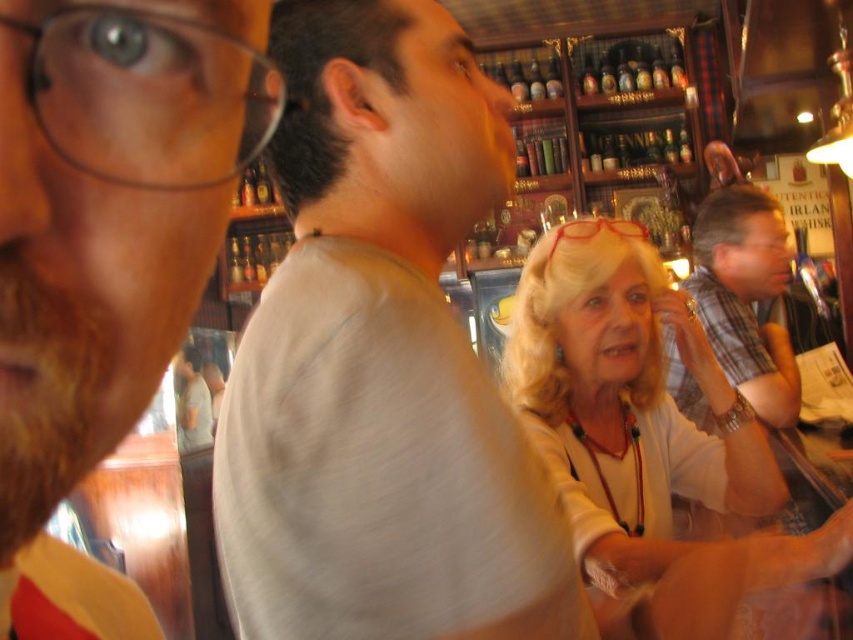
Question: Is gray cotton shirt at center to the right of light beige blouse at center from the viewer's perspective?

Choices:
 (A) yes
 (B) no

Answer: (B)

Question: Among these objects, which one is farthest from the camera?

Choices:
 (A) plaid shirt at right
 (B) gray cotton shirt at center

Answer: (A)

Question: Does white matte shirt at center lie behind plaid shirt at right?

Choices:
 (A) no
 (B) yes

Answer: (A)

Question: Which object is farther from the camera taking this photo?

Choices:
 (A) white matte shirt at center
 (B) plaid shirt at right
 (C) gray cotton shirt at center
 (D) light beige blouse at center

Answer: (B)

Question: Based on their relative distances, which object is farther from the plaid shirt at right?

Choices:
 (A) gray cotton shirt at center
 (B) light beige blouse at center
 (C) white matte shirt at center

Answer: (C)

Question: Is gray cotton shirt at center closer to camera compared to plaid shirt at right?

Choices:
 (A) no
 (B) yes

Answer: (B)